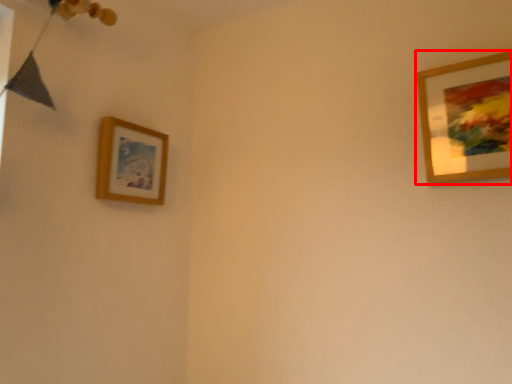
Question: From the image's perspective, what is the correct spatial relationship of picture frame (annotated by the red box) in relation to picture frame?

Choices:
 (A) below
 (B) above

Answer: (B)